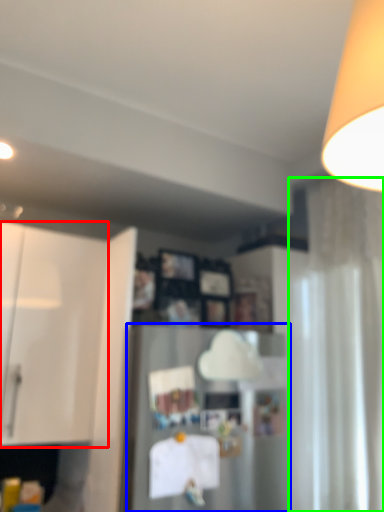
Question: Considering the real-world distances, which object is closest to cabinetry (highlighted by a red box)? appliance (highlighted by a blue box) or curtain (highlighted by a green box).

Choices:
 (A) appliance
 (B) curtain

Answer: (A)